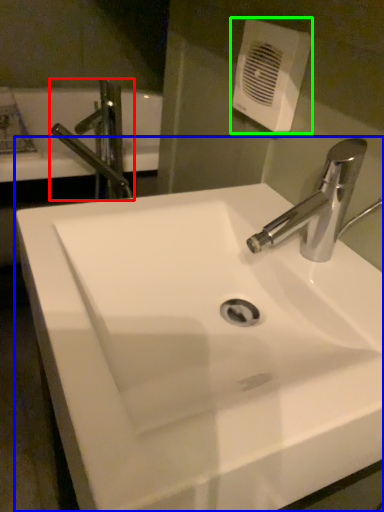
Question: Which is farther away from tap (highlighted by a red box)? sink (highlighted by a blue box) or hand dryer (highlighted by a green box)?

Choices:
 (A) sink
 (B) hand dryer

Answer: (A)